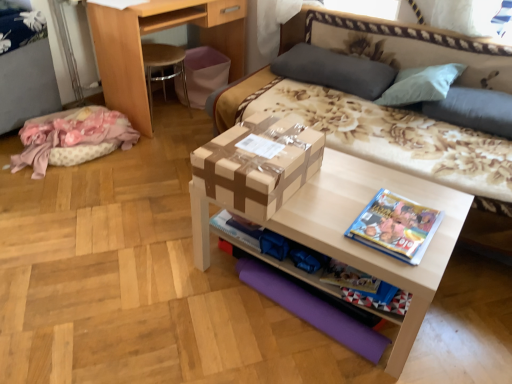
Question: From a real-world perspective, is brown cardboard box at center physically located above or below blue glossy book at right?

Choices:
 (A) below
 (B) above

Answer: (B)

Question: Considering the positions of brown cardboard box at center and blue glossy book at right in the image, is brown cardboard box at center wider or thinner than blue glossy book at right?

Choices:
 (A) wide
 (B) thin

Answer: (A)

Question: Based on their relative distances, which object is farther from the gray fabric pillow at upper right, which is the 2th pillow from left to right?

Choices:
 (A) brown cardboard box at center
 (B) matte cardboard box at center
 (C) light brown wood desk at upper left
 (D) gray fabric pillow at upper center, acting as the 2th pillow starting from the right
 (E) wooden at left

Answer: (E)

Question: Estimate the real-world distances between objects in this image. Which object is closer to the matte cardboard box at center?

Choices:
 (A) gray fabric pillow at upper right, the first pillow from the right
 (B) brown cardboard box at center
 (C) blue glossy book at right
 (D) wooden at left
 (E) pink fabric at left

Answer: (C)